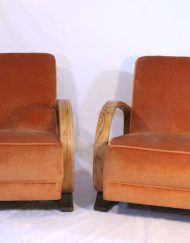
What are the coordinates of `2 orange colored chairs` in the screenshot? It's located at (35, 137), (157, 181).